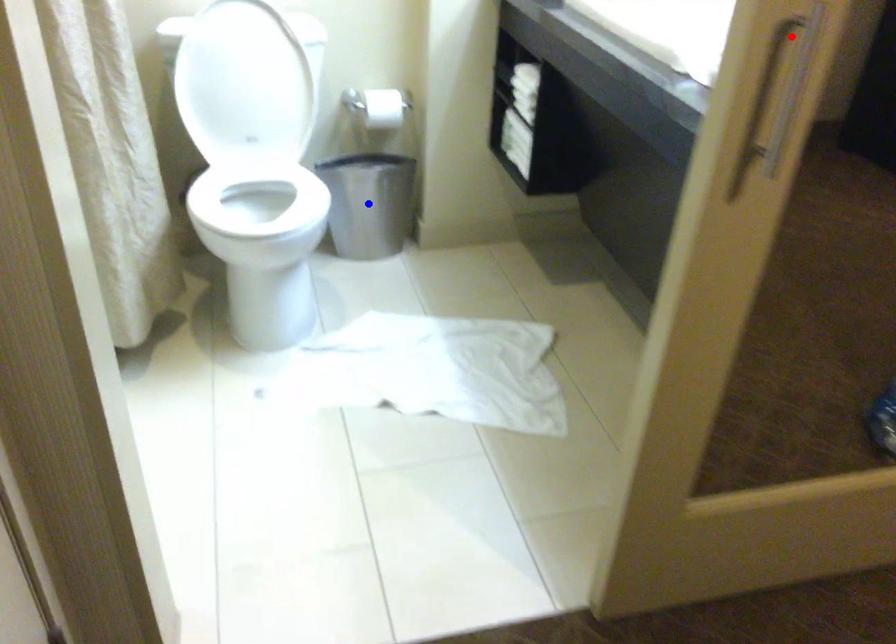
Question: Two points are marked on the image. Which point is closer to the camera?

Choices:
 (A) Blue point is closer.
 (B) Red point is closer.

Answer: (B)